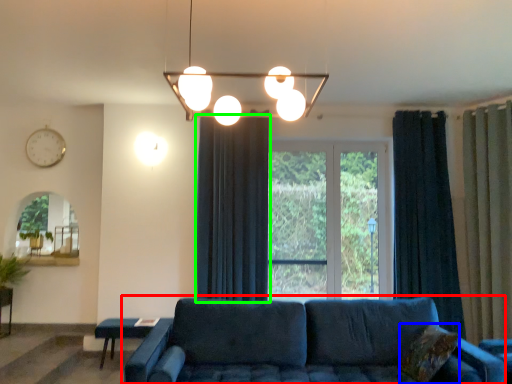
Question: Considering the real-world distances, which object is closest to studio couch (highlighted by a red box)? pillow (highlighted by a blue box) or curtain (highlighted by a green box).

Choices:
 (A) pillow
 (B) curtain

Answer: (A)